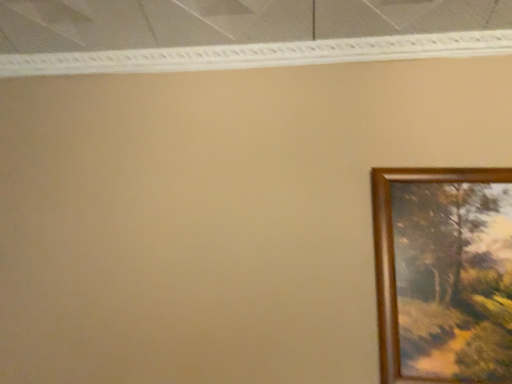
Measure the distance between brown wooden picture frame at right and camera.

brown wooden picture frame at right is 36.83 inches from camera.

You are a GUI agent. You are given a task and a screenshot of the screen. Output one action in this format:
    pyautogui.click(x=<x>, y=<y>)
    Task: Click on the brown wooden picture frame at right
    The height and width of the screenshot is (384, 512).
    Given the screenshot: What is the action you would take?
    (x=444, y=274)

What is the approximate width of brown wooden picture frame at right?

brown wooden picture frame at right is 2.25 inches wide.

The height and width of the screenshot is (384, 512). What do you see at coordinates (444, 274) in the screenshot?
I see `brown wooden picture frame at right` at bounding box center [444, 274].

The width and height of the screenshot is (512, 384). Find the location of `brown wooden picture frame at right`. brown wooden picture frame at right is located at coordinates (444, 274).